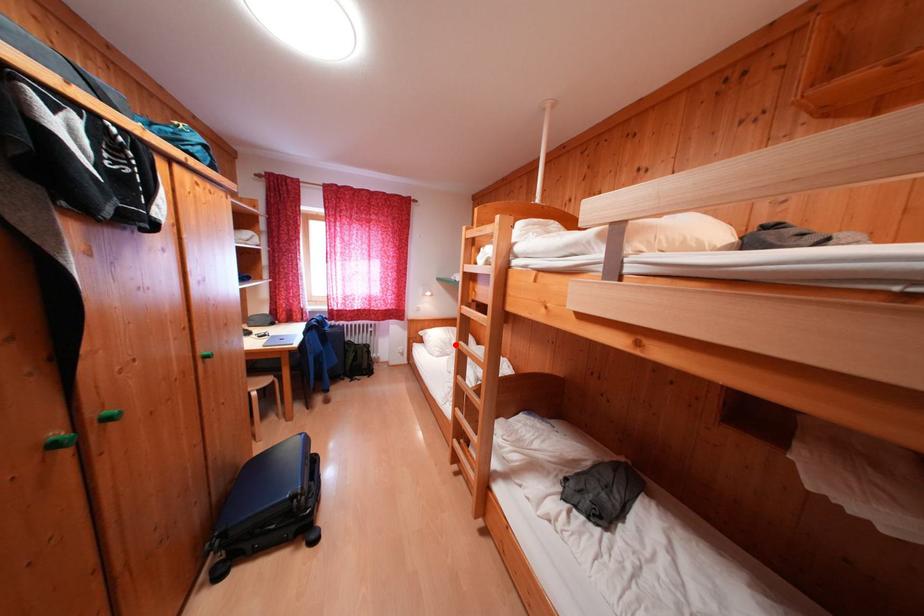
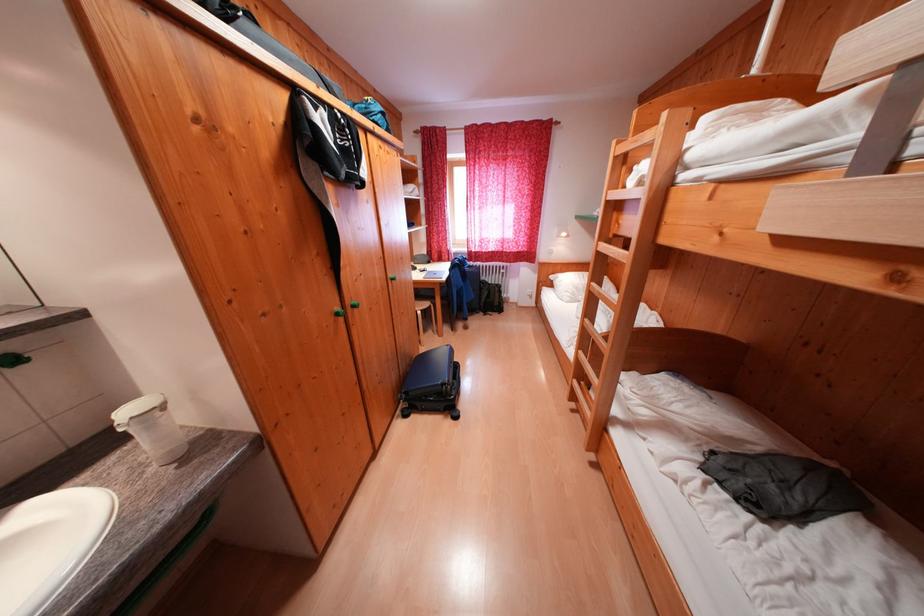
Question: A red point is marked in image1. In image2, is the corresponding 3D point closer to the camera or farther? Reply with the corresponding letter.

Choices:
 (A) The corresponding 3D point is closer.
 (B) The corresponding 3D point is farther.

Answer: (A)